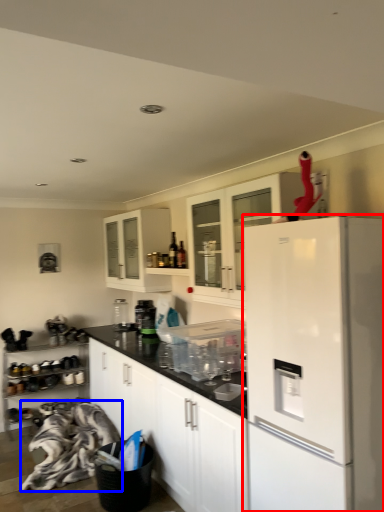
Question: Which object appears farthest to the camera in this image, refrigerator (highlighted by a red box) or material (highlighted by a blue box)?

Choices:
 (A) refrigerator
 (B) material

Answer: (B)